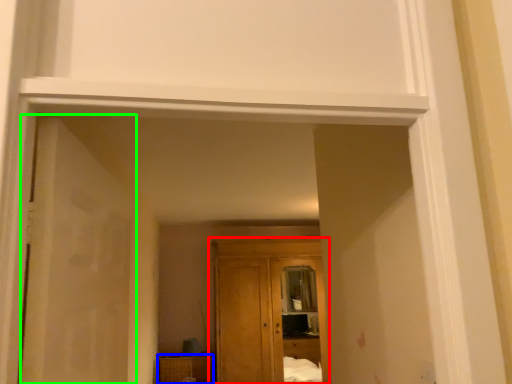
Question: Which object is positioned closest to cupboard (highlighted by a red box)? Select from cabinetry (highlighted by a blue box) and door (highlighted by a green box).

Choices:
 (A) cabinetry
 (B) door

Answer: (A)